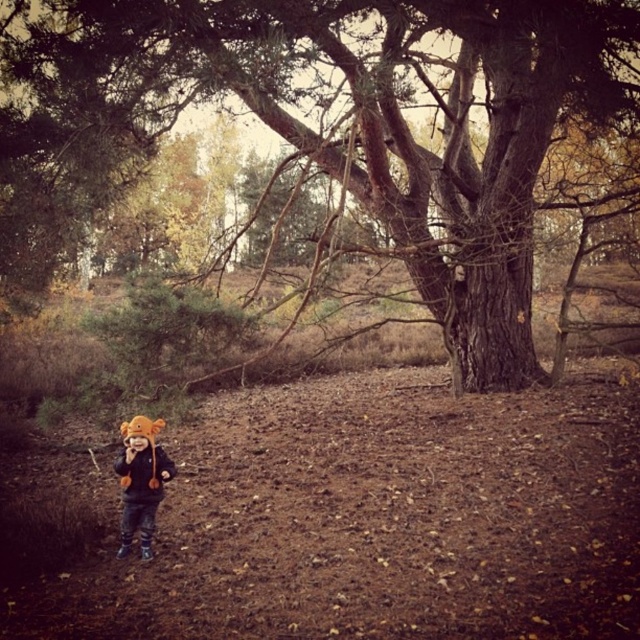
Between point (129, 449) and point (147, 484), which one is positioned behind?

The point (129, 449) is more distant.

Which is more to the right, brown fuzzy hat at lower left or orange fuzzy jacket at lower left?

brown fuzzy hat at lower left

Does point (138, 449) come closer to viewer compared to point (161, 448)?

Yes, point (138, 449) is in front of point (161, 448).

The image size is (640, 640). In order to click on brown fuzzy hat at lower left in this screenshot , I will do `click(140, 481)`.

Who is positioned more to the right, brown rough bark tree at center or brown fuzzy hat at lower left?

From the viewer's perspective, brown rough bark tree at center appears more on the right side.

Does brown rough bark tree at center have a smaller size compared to brown fuzzy hat at lower left?

No.

Measure the distance between brown rough bark tree at center and camera.

brown rough bark tree at center is 5.42 meters from camera.

Locate an element on the screen. The image size is (640, 640). brown rough bark tree at center is located at coordinates (348, 122).

Which of these two, brown rough bark tree at center or orange fuzzy jacket at lower left, stands shorter?

With less height is orange fuzzy jacket at lower left.

Can you confirm if brown rough bark tree at center is taller than orange fuzzy jacket at lower left?

A: Indeed, brown rough bark tree at center has a greater height compared to orange fuzzy jacket at lower left.

Identify the location of brown rough bark tree at center. Image resolution: width=640 pixels, height=640 pixels. (348, 122).